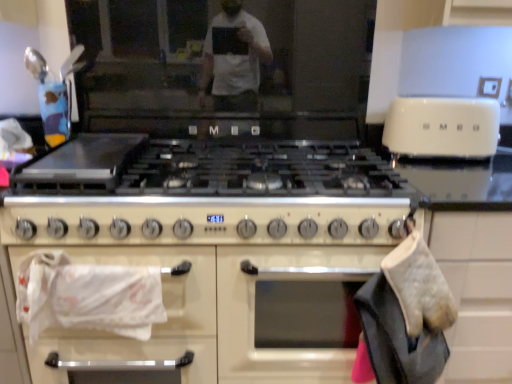
The image size is (512, 384). What do you see at coordinates (442, 127) in the screenshot? I see `white glossy toaster at upper right` at bounding box center [442, 127].

Locate an element on the screen. The width and height of the screenshot is (512, 384). white glossy toaster at upper right is located at coordinates (442, 127).

Measure the distance between point (479, 145) and camera.

4.68 feet.

Describe the element at coordinates (153, 324) in the screenshot. This screenshot has width=512, height=384. I see `white glossy towel at lower left` at that location.

The height and width of the screenshot is (384, 512). What are the coordinates of `white glossy towel at lower left` in the screenshot? It's located at (153, 324).

Identify the location of white glossy toaster at upper right. Image resolution: width=512 pixels, height=384 pixels. (442, 127).

Between white glossy towel at lower left and white glossy toaster at upper right, which one appears on the left side from the viewer's perspective?

white glossy towel at lower left is more to the left.

Which object is further away from the camera taking this photo, white glossy towel at lower left or white glossy toaster at upper right?

white glossy toaster at upper right is behind.

Which point is more forward, (131,347) or (392,115)?

The point (131,347) is in front.

From the image's perspective, would you say white glossy towel at lower left is positioned over white glossy toaster at upper right?

Actually, white glossy towel at lower left appears below white glossy toaster at upper right in the image.

From a real-world perspective, between white glossy towel at lower left and white glossy toaster at upper right, who is vertically lower?

white glossy towel at lower left is physically lower.

In the scene shown: Considering the sizes of objects white glossy towel at lower left and white glossy toaster at upper right in the image provided, who is wider, white glossy towel at lower left or white glossy toaster at upper right?

white glossy toaster at upper right is wider.

Is white glossy towel at lower left taller or shorter than white glossy toaster at upper right?

white glossy towel at lower left is taller than white glossy toaster at upper right.

Between white glossy towel at lower left and white glossy toaster at upper right, which one has smaller size?

white glossy towel at lower left is smaller.

Is white glossy towel at lower left completely or partially outside of white glossy toaster at upper right?

Yes, white glossy towel at lower left is outside of white glossy toaster at upper right.

In the scene shown: Would you consider white glossy towel at lower left to be distant from white glossy toaster at upper right?

white glossy towel at lower left is near white glossy toaster at upper right, not far away.

Is white glossy towel at lower left facing away from white glossy toaster at upper right?

No, white glossy towel at lower left's orientation is not away from white glossy toaster at upper right.

What's the angular difference between white glossy towel at lower left and white glossy toaster at upper right's facing directions?

0.955 degrees separate the facing orientations of white glossy towel at lower left and white glossy toaster at upper right.

You are a GUI agent. You are given a task and a screenshot of the screen. Output one action in this format:
    pyautogui.click(x=<x>, y=<y>)
    Task: Click on the toaster above the white glossy towel at lower left (from a real-world perspective)
    The width and height of the screenshot is (512, 384).
    Given the screenshot: What is the action you would take?
    pyautogui.click(x=442, y=127)

Considering the positions of objects white glossy toaster at upper right and white glossy towel at lower left in the image provided, who is more to the left, white glossy toaster at upper right or white glossy towel at lower left?

From the viewer's perspective, white glossy towel at lower left appears more on the left side.

Considering the positions of objects white glossy toaster at upper right and white glossy towel at lower left in the image provided, who is in front, white glossy toaster at upper right or white glossy towel at lower left?

white glossy towel at lower left.

Considering the points (439, 102) and (26, 342), which point is in front, point (439, 102) or point (26, 342)?

The point (26, 342) is in front.

From the image's perspective, would you say white glossy toaster at upper right is shown under white glossy towel at lower left?

No, from the image's perspective, white glossy toaster at upper right is not below white glossy towel at lower left.

From a real-world perspective, is white glossy toaster at upper right positioned under white glossy towel at lower left based on gravity?

No, from a real-world perspective, white glossy toaster at upper right is not below white glossy towel at lower left.

Is white glossy toaster at upper right wider than white glossy towel at lower left?

Indeed, white glossy toaster at upper right has a greater width compared to white glossy towel at lower left.

In the scene shown: Can you confirm if white glossy toaster at upper right is taller than white glossy towel at lower left?

No.

Which of these two, white glossy toaster at upper right or white glossy towel at lower left, is bigger?

With larger size is white glossy toaster at upper right.

Based on the photo, would you say white glossy toaster at upper right contains white glossy towel at lower left?

No, white glossy towel at lower left is located outside of white glossy toaster at upper right.

Is white glossy toaster at upper right next to white glossy towel at lower left?

No, white glossy toaster at upper right is not in contact with white glossy towel at lower left.

Is white glossy toaster at upper right oriented away from white glossy towel at lower left?

No, white glossy towel at lower left is not at the back of white glossy toaster at upper right.

Can you tell me how much white glossy toaster at upper right and white glossy towel at lower left differ in facing direction?

The facing directions of white glossy toaster at upper right and white glossy towel at lower left are 0.955 degrees apart.

What are the coordinates of `cabinetry in front of the white glossy toaster at upper right` in the screenshot? It's located at (153, 324).

In the image, there is a white glossy toaster at upper right. Find the location of `cabinetry below it (from the image's perspective)`. cabinetry below it (from the image's perspective) is located at coordinates (153, 324).

Where is `cabinetry on the left of white glossy toaster at upper right`? Image resolution: width=512 pixels, height=384 pixels. cabinetry on the left of white glossy toaster at upper right is located at coordinates (153, 324).